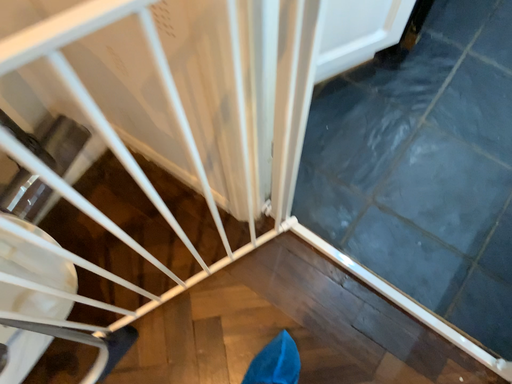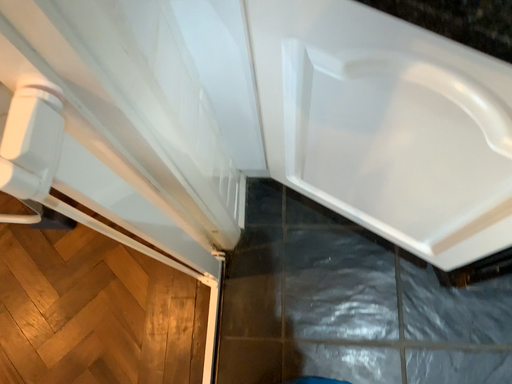
Question: How did the camera likely rotate when shooting the video?

Choices:
 (A) rotated right
 (B) rotated left

Answer: (B)